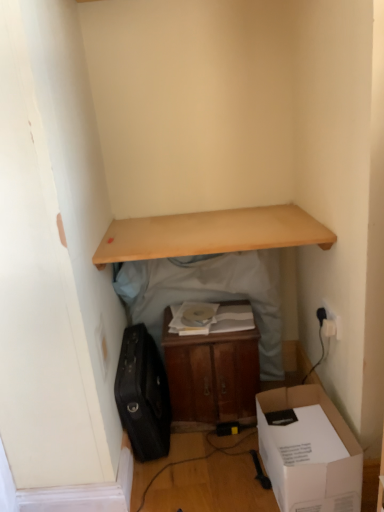
Locate an element on the screen. The height and width of the screenshot is (512, 384). white plastic electric outlet at upper right is located at coordinates (331, 322).

What is the approximate width of black leather suitcase at lower left?

The width of black leather suitcase at lower left is 17.49 inches.

What do you see at coordinates (210, 234) in the screenshot? I see `light wood shelf at upper center` at bounding box center [210, 234].

Identify the location of white plastic electric outlet at upper right. (331, 322).

Is the surface of light wood shelf at upper center in direct contact with white cardboard box at lower right?

They are not placed beside each other.

Can you confirm if light wood shelf at upper center is bigger than white cardboard box at lower right?

No, light wood shelf at upper center is not bigger than white cardboard box at lower right.

Is light wood shelf at upper center looking in the opposite direction of white cardboard box at lower right?

No, light wood shelf at upper center's orientation is not away from white cardboard box at lower right.

Can you tell me how much white cardboard box at lower right and light wood shelf at upper center differ in facing direction?

The angle between the facing direction of white cardboard box at lower right and the facing direction of light wood shelf at upper center is 9.24 degrees.

Is white cardboard box at lower right taller than light wood shelf at upper center?

Yes, white cardboard box at lower right is taller than light wood shelf at upper center.

At what (x,y) coordinates should I click in order to perform the action: click on desk above the white cardboard box at lower right (from the image's perspective). Please return your answer as a coordinate pair (x, y). Image resolution: width=384 pixels, height=512 pixels. Looking at the image, I should click on (210, 234).

Considering the relative sizes of white cardboard box at lower right and light wood shelf at upper center in the image provided, is white cardboard box at lower right bigger than light wood shelf at upper center?

Correct, white cardboard box at lower right is larger in size than light wood shelf at upper center.

From a real-world perspective, is black leather suitcase at lower left located beneath wooden shelf at upper center, arranged as the second table when viewed from the left?

Yes.

Is black leather suitcase at lower left spatially inside wooden shelf at upper center, placed as the 1th table when sorted from right to left, or outside of it?

black leather suitcase at lower left cannot be found inside wooden shelf at upper center, placed as the 1th table when sorted from right to left.

Is point (127, 407) less distant than point (233, 219)?

Yes.

From the image's perspective, would you say black leather suitcase at lower left is positioned over wooden shelf at upper center, placed as the 1th table when sorted from right to left?

No.

From a real-world perspective, is wooden cabinet at center, marked as the 1th table in a left-to-right arrangement, located beneath black leather suitcase at lower left?

No, from a real-world perspective, wooden cabinet at center, marked as the 1th table in a left-to-right arrangement, is not under black leather suitcase at lower left.

From the image's perspective, relative to black leather suitcase at lower left, is wooden cabinet at center, the second table in the right-to-left sequence, above or below?

wooden cabinet at center, the second table in the right-to-left sequence, is above black leather suitcase at lower left.

Consider the image. Is wooden cabinet at center, the second table in the right-to-left sequence, wider or thinner than black leather suitcase at lower left?

In the image, wooden cabinet at center, the second table in the right-to-left sequence, appears to be more narrow than black leather suitcase at lower left.

Does wooden cabinet at center, marked as the 1th table in a left-to-right arrangement, have a greater height compared to black leather suitcase at lower left?

Correct, wooden cabinet at center, marked as the 1th table in a left-to-right arrangement, is much taller as black leather suitcase at lower left.

Find the location of a particular element. This screenshot has height=512, width=384. the 2nd table below when counting from the white plastic electric outlet at upper right (from the image's perspective) is located at coordinates (x=211, y=374).

Which object is closer to the camera taking this photo, wooden cabinet at center, the second table in the right-to-left sequence, or white plastic electric outlet at upper right?

white plastic electric outlet at upper right is closer to the camera.

Would you say wooden cabinet at center, the second table in the right-to-left sequence, contains white plastic electric outlet at upper right?

No, white plastic electric outlet at upper right is not surrounded by wooden cabinet at center, the second table in the right-to-left sequence.

From a real-world perspective, is wooden cabinet at center, the second table in the right-to-left sequence, beneath white plastic electric outlet at upper right?

Yes, from a real-world perspective, wooden cabinet at center, the second table in the right-to-left sequence, is under white plastic electric outlet at upper right.

Considering the relative positions of wooden cabinet at center, the second table in the right-to-left sequence, and white cardboard box at lower right in the image provided, is wooden cabinet at center, the second table in the right-to-left sequence, behind white cardboard box at lower right?

Yes, it is.

Would you consider wooden cabinet at center, the second table in the right-to-left sequence, to be distant from white cardboard box at lower right?

No.

Looking at their sizes, would you say wooden cabinet at center, the second table in the right-to-left sequence, is wider or thinner than white cardboard box at lower right?

wooden cabinet at center, the second table in the right-to-left sequence, is thinner than white cardboard box at lower right.

Would you say wooden cabinet at center, marked as the 1th table in a left-to-right arrangement, is inside or outside wooden shelf at upper center, placed as the 1th table when sorted from right to left?

wooden cabinet at center, marked as the 1th table in a left-to-right arrangement, is located inside wooden shelf at upper center, placed as the 1th table when sorted from right to left.

Which object is further away from the camera, wooden cabinet at center, the second table in the right-to-left sequence, or wooden shelf at upper center, arranged as the second table when viewed from the left?

wooden shelf at upper center, arranged as the second table when viewed from the left.

In the scene shown: Can you confirm if wooden cabinet at center, the second table in the right-to-left sequence, is positioned to the right of wooden shelf at upper center, placed as the 1th table when sorted from right to left?

Incorrect, wooden cabinet at center, the second table in the right-to-left sequence, is not on the right side of wooden shelf at upper center, placed as the 1th table when sorted from right to left.

Is wooden cabinet at center, the second table in the right-to-left sequence, far from wooden shelf at upper center, arranged as the second table when viewed from the left?

No, wooden cabinet at center, the second table in the right-to-left sequence, is not far from wooden shelf at upper center, arranged as the second table when viewed from the left.

Find the location of a particular element. desk on the left side of white cardboard box at lower right is located at coordinates (210, 234).

At what (x,y) coordinates should I click in order to perform the action: click on box that appears on the right of light wood shelf at upper center. Please return your answer as a coordinate pair (x, y). The height and width of the screenshot is (512, 384). Looking at the image, I should click on (309, 452).

Estimate the real-world distances between objects in this image. Which object is closer to white plastic electric outlet at upper right, wooden shelf at upper center, arranged as the second table when viewed from the left, or light wood shelf at upper center?

Among the two, light wood shelf at upper center is located nearer to white plastic electric outlet at upper right.

Estimate the real-world distances between objects in this image. Which object is closer to light wood shelf at upper center, wooden cabinet at center, the second table in the right-to-left sequence, or wooden shelf at upper center, arranged as the second table when viewed from the left?

wooden shelf at upper center, arranged as the second table when viewed from the left, is positioned closer to the anchor light wood shelf at upper center.

When comparing their distances from wooden cabinet at center, marked as the 1th table in a left-to-right arrangement, does black leather suitcase at lower left or wooden shelf at upper center, arranged as the second table when viewed from the left, seem further?

Based on the image, wooden shelf at upper center, arranged as the second table when viewed from the left, appears to be further to wooden cabinet at center, marked as the 1th table in a left-to-right arrangement.

When comparing their distances from white cardboard box at lower right, does light wood shelf at upper center or white plastic electric outlet at upper right seem closer?

Based on the image, white plastic electric outlet at upper right appears to be nearer to white cardboard box at lower right.

From the image, which object appears to be farther from white plastic electric outlet at upper right, light wood shelf at upper center or wooden cabinet at center, marked as the 1th table in a left-to-right arrangement?

The object further to white plastic electric outlet at upper right is light wood shelf at upper center.

Estimate the real-world distances between objects in this image. Which object is closer to light wood shelf at upper center, wooden shelf at upper center, arranged as the second table when viewed from the left, or white plastic electric outlet at upper right?

Among the two, wooden shelf at upper center, arranged as the second table when viewed from the left, is located nearer to light wood shelf at upper center.

Considering their positions, is wooden cabinet at center, the second table in the right-to-left sequence, positioned closer to wooden shelf at upper center, placed as the 1th table when sorted from right to left, than light wood shelf at upper center?

The object closer to wooden shelf at upper center, placed as the 1th table when sorted from right to left, is light wood shelf at upper center.

Consider the image. Looking at the image, which one is located closer to wooden cabinet at center, the second table in the right-to-left sequence, light wood shelf at upper center or white cardboard box at lower right?

Among the two, white cardboard box at lower right is located nearer to wooden cabinet at center, the second table in the right-to-left sequence.

You are a GUI agent. You are given a task and a screenshot of the screen. Output one action in this format:
    pyautogui.click(x=<x>, y=<y>)
    Task: Click on the table between light wood shelf at upper center and wooden cabinet at center, marked as the 1th table in a left-to-right arrangement, in the vertical direction
    The height and width of the screenshot is (512, 384).
    Given the screenshot: What is the action you would take?
    tap(211, 233)

Identify the location of table situated between wooden cabinet at center, the second table in the right-to-left sequence, and white plastic electric outlet at upper right from left to right. The width and height of the screenshot is (384, 512). (211, 233).

This screenshot has height=512, width=384. Find the location of `luggage that lies between light wood shelf at upper center and white cardboard box at lower right from top to bottom`. luggage that lies between light wood shelf at upper center and white cardboard box at lower right from top to bottom is located at coordinates (143, 395).

Where is `box situated between black leather suitcase at lower left and white plastic electric outlet at upper right from left to right`? The height and width of the screenshot is (512, 384). box situated between black leather suitcase at lower left and white plastic electric outlet at upper right from left to right is located at coordinates (309, 452).